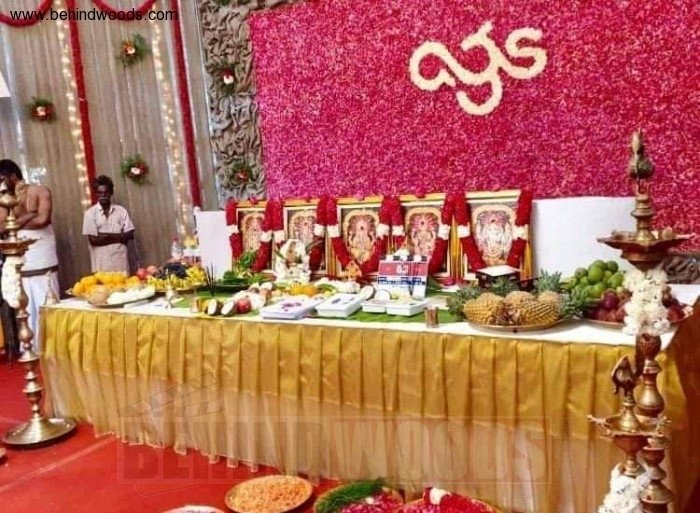
Image resolution: width=700 pixels, height=513 pixels. Identify the location of giant table. 586,340.